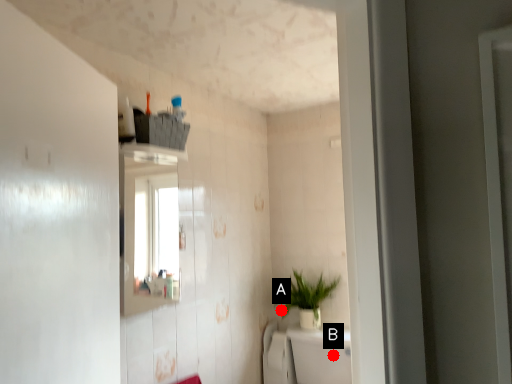
Question: Two points are circled on the image, labeled by A and B beside each circle. Which of the following is the farthest from the observer?

Choices:
 (A) A is further
 (B) B is further

Answer: (A)